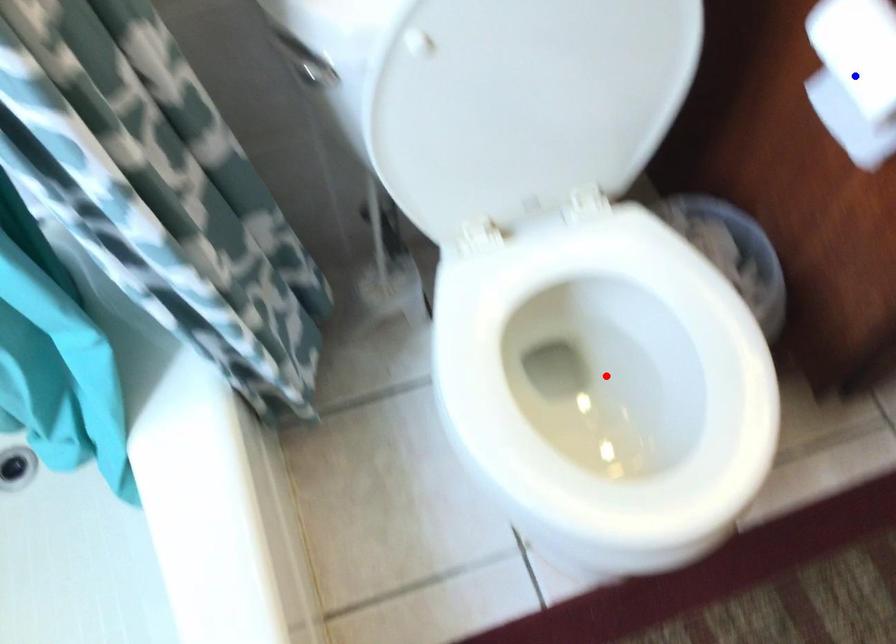
Question: In the image, two points are highlighted. Which point is nearer to the camera? Reply with the corresponding letter.

Choices:
 (A) blue point
 (B) red point

Answer: (A)